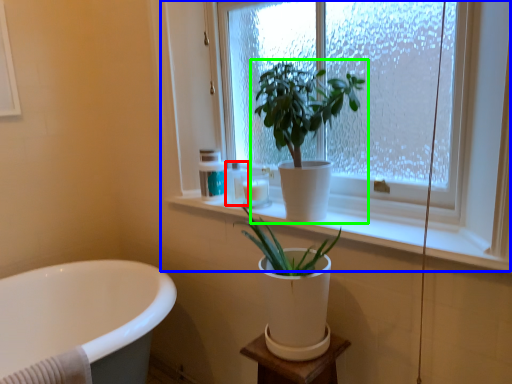
Question: Which object is positioned farthest from toiletry (highlighted by a red box)? Select from window (highlighted by a blue box) and houseplant (highlighted by a green box).

Choices:
 (A) window
 (B) houseplant

Answer: (A)